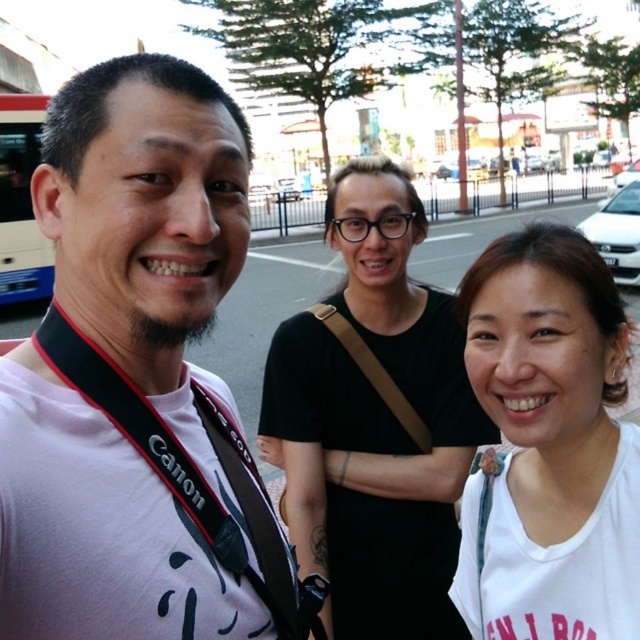
From the picture: Can you confirm if white matte tank top at center is positioned to the right of blue painted decker bus at left?

Correct, you'll find white matte tank top at center to the right of blue painted decker bus at left.

Does point (502, 298) lie behind point (20, 138)?

No, (502, 298) is in front of (20, 138).

Identify the location of white matte tank top at center. tap(550, 444).

This screenshot has width=640, height=640. I want to click on white matte tank top at center, so click(x=550, y=444).

What are the coordinates of `pink fabric shirt at left` in the screenshot? It's located at (128, 365).

Is pink fabric shirt at left behind white matte tank top at center?

That is False.

Does point (260, 611) come closer to viewer compared to point (612, 355)?

That is True.

Where is `pink fabric shirt at left`? pink fabric shirt at left is located at coordinates (128, 365).

Is white matte shirt at center taller than white matte tank top at center?

Yes.

What do you see at coordinates (374, 420) in the screenshot?
I see `white matte shirt at center` at bounding box center [374, 420].

The image size is (640, 640). I want to click on white matte shirt at center, so click(x=374, y=420).